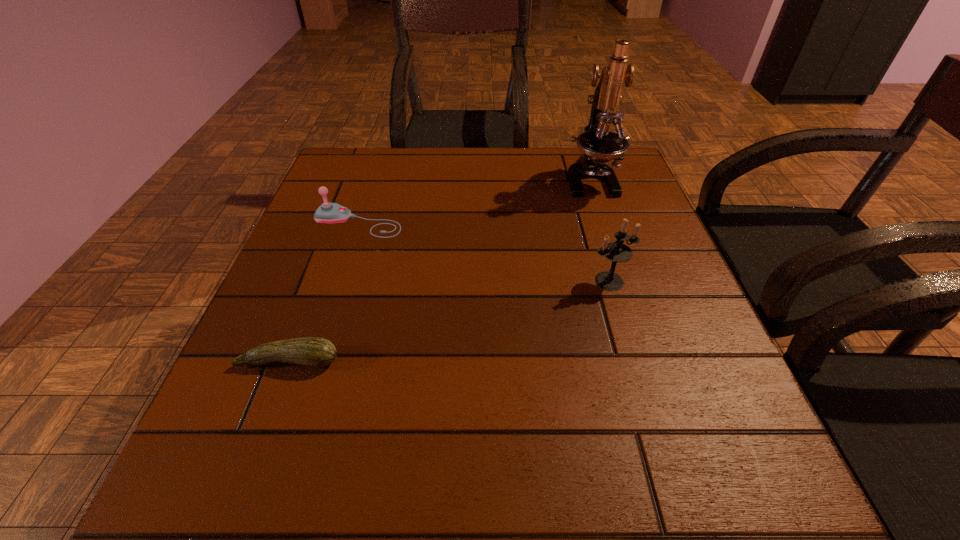
The image size is (960, 540). I want to click on microscope, so click(599, 145).

Where is `the tallest object`? the tallest object is located at coordinates (599, 145).

The width and height of the screenshot is (960, 540). What are the coordinates of `the third farthest object` in the screenshot? It's located at (616, 251).

Where is `the second tallest object`? the second tallest object is located at coordinates (616, 251).

You are a GUI agent. You are given a task and a screenshot of the screen. Output one action in this format:
    pyautogui.click(x=<x>, y=<y>)
    Task: Click on the joystick
    
    Given the screenshot: What is the action you would take?
    pyautogui.click(x=328, y=212)

This screenshot has width=960, height=540. Identify the location of the second shortest object. (328, 212).

This screenshot has width=960, height=540. Find the location of `the shortest object`. the shortest object is located at coordinates (317, 352).

I want to click on zucchini, so click(x=317, y=352).

Where is `vacant space located at the eyepiece of the microscope`? This screenshot has width=960, height=540. vacant space located at the eyepiece of the microscope is located at coordinates (636, 317).

Identify the location of vacant space situated on the left of the candle holder. The height and width of the screenshot is (540, 960). (455, 281).